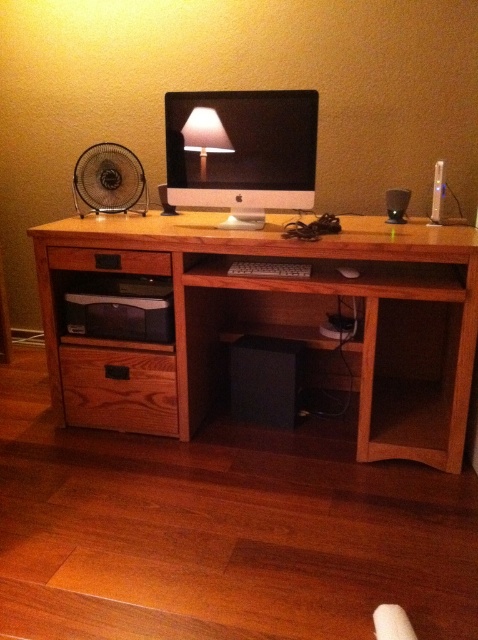
You are standing in the home office and want to place a new keyboard on the wooden computer desk at center. Can you place it at the point with coordinates point (281, 326)?

Yes, the point (281, 326) is on the wooden computer desk at center, so you can place the keyboard there.

You are standing in front of a wooden computer desk at center. There is a point marked at coordinates (281, 326). Where exactly on the desk is this point located?

The point (281, 326) is located on the wooden computer desk at center.

You are setting up a new monitor in your home office. You want to place the satin white monitor at center on top of the wooden computer desk at center. Is this possible given their current positions?

The wooden computer desk at center is located below the satin white monitor at center, so placing the satin white monitor at center on top of the wooden computer desk at center is already possible as they are positioned in that manner.